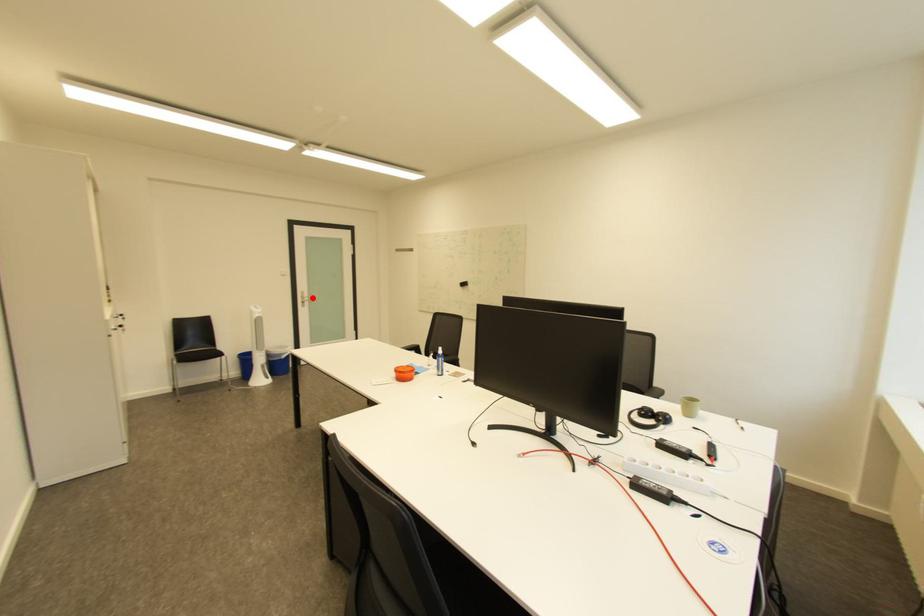
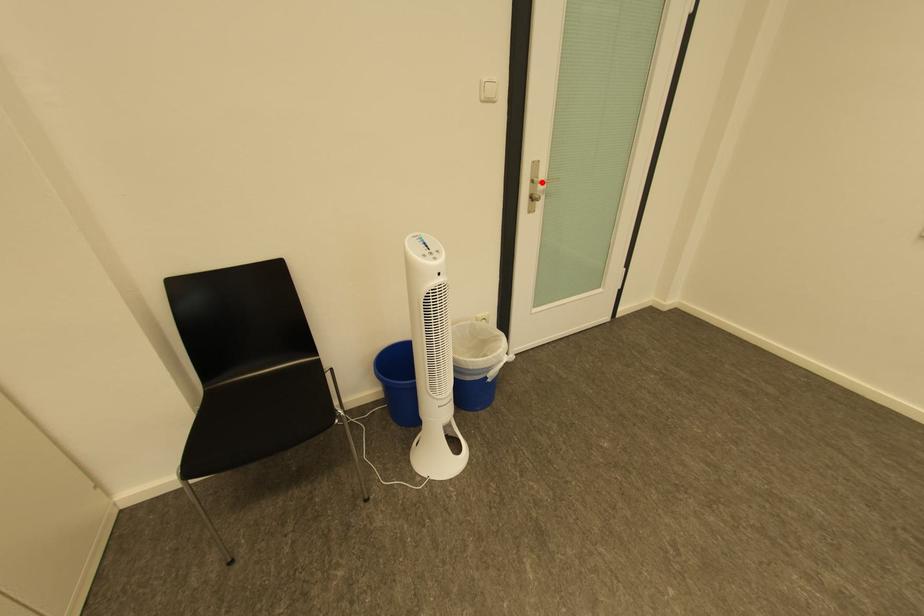
I am providing you with two images of the same scene from different viewpoints. A red point is marked on the first image and another point is marked on the second image. Is the red point in image1 aligned with the point shown in image2?

Yes